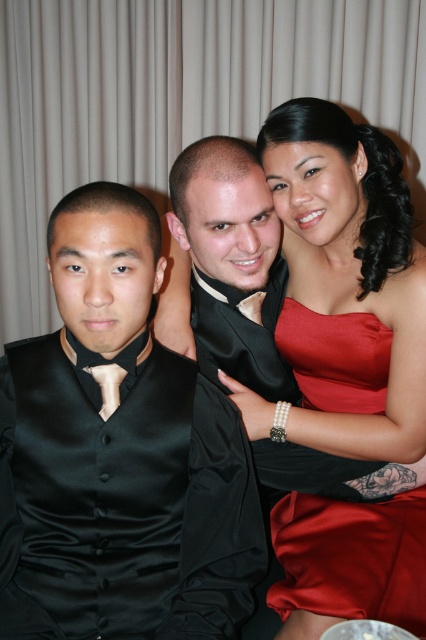
Can you confirm if black satin vest at left is smaller than shiny satin dress at upper right?

Indeed, black satin vest at left has a smaller size compared to shiny satin dress at upper right.

Can you confirm if black satin vest at left is positioned below shiny satin dress at upper right?

Incorrect, black satin vest at left is not positioned below shiny satin dress at upper right.

Locate an element on the screen. black satin vest at left is located at coordinates (118, 456).

The width and height of the screenshot is (426, 640). I want to click on black satin vest at left, so click(118, 456).

Which is behind, point (374, 376) or point (112, 371)?

Positioned behind is point (374, 376).

Image resolution: width=426 pixels, height=640 pixels. What do you see at coordinates (351, 556) in the screenshot? I see `shiny satin dress at upper right` at bounding box center [351, 556].

Describe the element at coordinates (351, 556) in the screenshot. The height and width of the screenshot is (640, 426). I see `shiny satin dress at upper right` at that location.

Locate an element on the screen. The image size is (426, 640). shiny satin dress at upper right is located at coordinates (351, 556).

Which is more to the left, black satin vest at left or matte black tie at left?

From the viewer's perspective, matte black tie at left appears more on the left side.

In the scene shown: Is black satin vest at left bigger than matte black tie at left?

Indeed, black satin vest at left has a larger size compared to matte black tie at left.

Locate an element on the screen. black satin vest at left is located at coordinates click(118, 456).

At what (x,y) coordinates should I click in order to perform the action: click on black satin vest at left. Please return your answer as a coordinate pair (x, y). The height and width of the screenshot is (640, 426). Looking at the image, I should click on (118, 456).